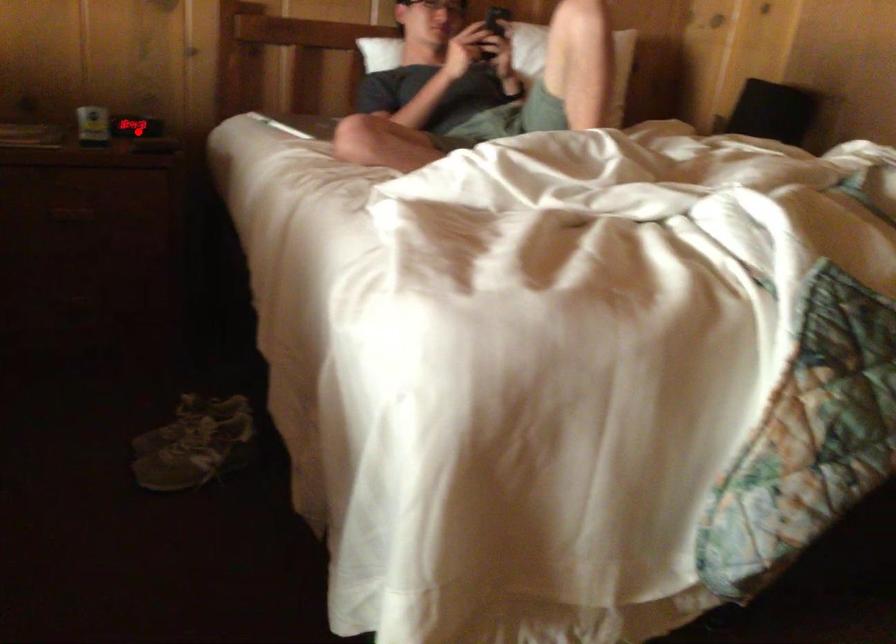
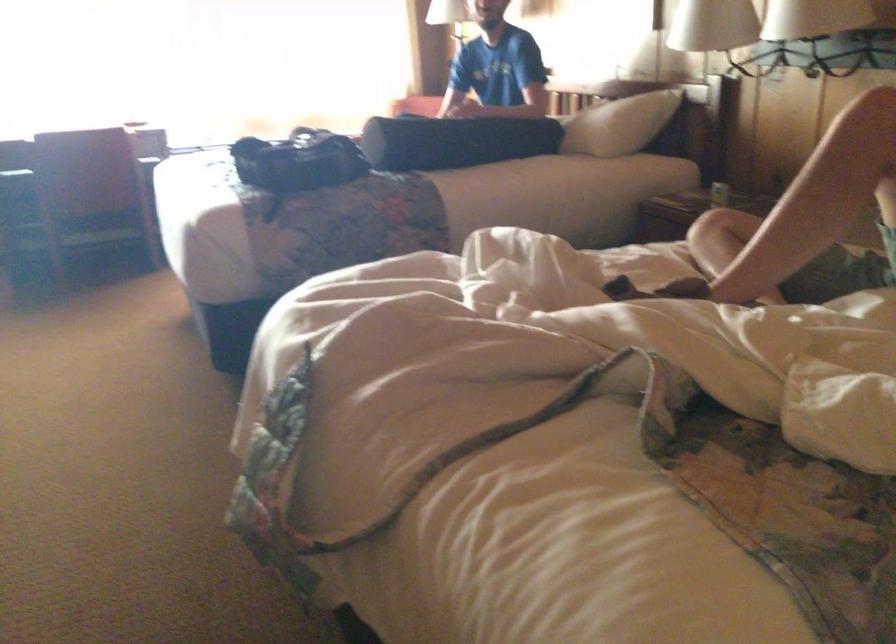
In the second image, find the point that corresponds to the highlighted location in the first image.

(719, 194)